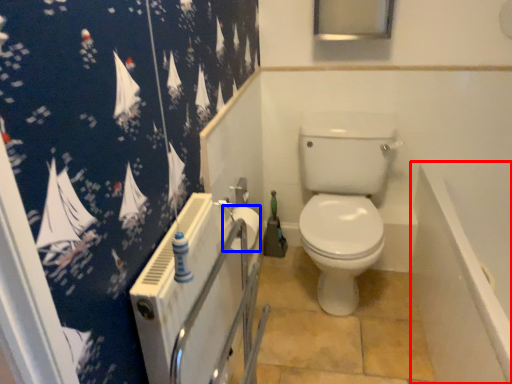
Question: Which of the following is the farthest to the observer, bath (highlighted by a red box) or toilet paper (highlighted by a blue box)?

Choices:
 (A) bath
 (B) toilet paper

Answer: (B)